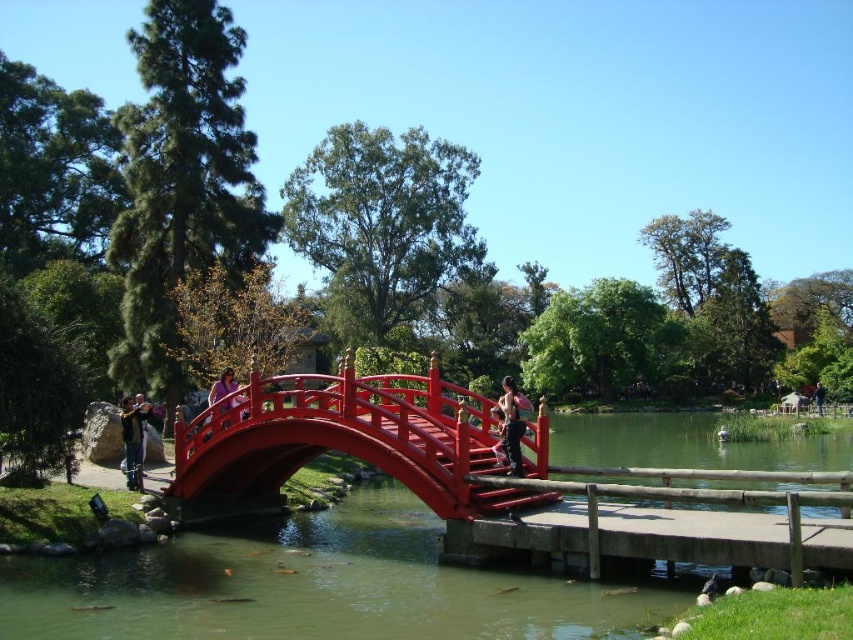
Does wooden dock at center lie behind matte pink tank top at center?

Result: No, it is in front of matte pink tank top at center.

I want to click on wooden dock at center, so click(663, 520).

Find the location of `wooden dock at center`. wooden dock at center is located at coordinates (663, 520).

Is matte black jacket at left thinner than blue fabric jacket at center?

Yes, matte black jacket at left is thinner than blue fabric jacket at center.

Which of these two, matte black jacket at left or blue fabric jacket at center, stands taller?

With more height is matte black jacket at left.

Image resolution: width=853 pixels, height=640 pixels. Describe the element at coordinates (132, 440) in the screenshot. I see `matte black jacket at left` at that location.

Locate an element on the screen. The width and height of the screenshot is (853, 640). matte black jacket at left is located at coordinates (132, 440).

Does matte black jacket at left appear on the right side of purple fabric at center?

No, matte black jacket at left is not to the right of purple fabric at center.

Does point (138, 461) lie behind point (212, 390)?

No, it is in front of (212, 390).

At what (x,y) coordinates should I click in order to perform the action: click on matte black jacket at left. Please return your answer as a coordinate pair (x, y). This screenshot has width=853, height=640. Looking at the image, I should click on (132, 440).